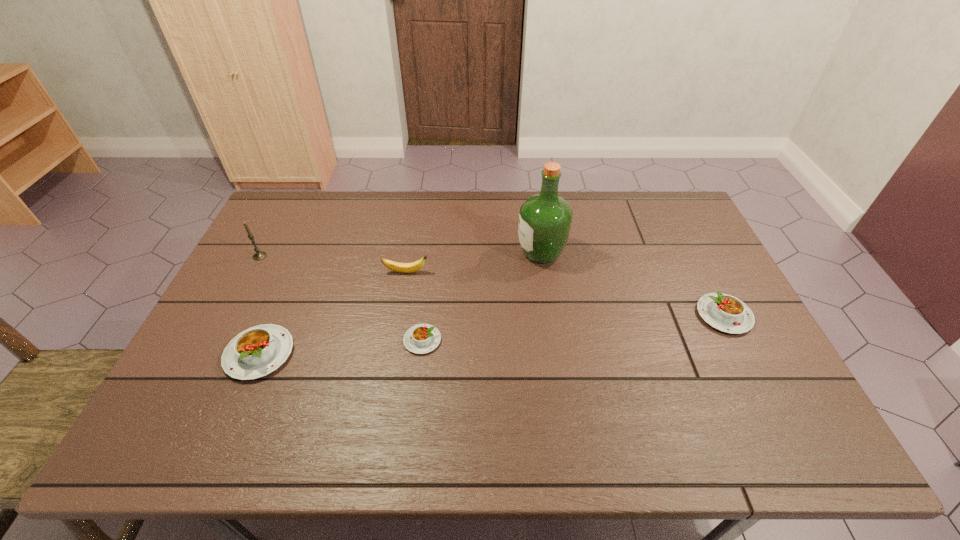
Locate an element on the screen. The height and width of the screenshot is (540, 960). candle at the left edge is located at coordinates (259, 255).

Locate an element on the screen. object positioned at the right edge is located at coordinates (726, 313).

The width and height of the screenshot is (960, 540). In order to click on object present at the near left corner in this screenshot , I will do `click(256, 352)`.

In the image, there is a desktop. At what (x,y) coordinates should I click in order to perform the action: click on vacant area at the far edge. Please return your answer as a coordinate pair (x, y). Looking at the image, I should click on (x=458, y=225).

The height and width of the screenshot is (540, 960). In the image, there is a desktop. Identify the location of free region at the near edge. tap(626, 400).

At what (x,y) coordinates should I click in order to perform the action: click on vacant space at the left edge of the desktop. Please return your answer as a coordinate pair (x, y). The height and width of the screenshot is (540, 960). Looking at the image, I should click on (230, 309).

Where is `blank space at the right edge`? blank space at the right edge is located at coordinates (692, 233).

The width and height of the screenshot is (960, 540). I want to click on blank area at the far left corner, so click(x=262, y=232).

The width and height of the screenshot is (960, 540). What are the coordinates of `vacant space that's between the shortest pudding and the rightmost object` in the screenshot? It's located at (x=573, y=328).

What are the coordinates of `free point between the leftmost pudding and the shortest object` in the screenshot? It's located at (341, 347).